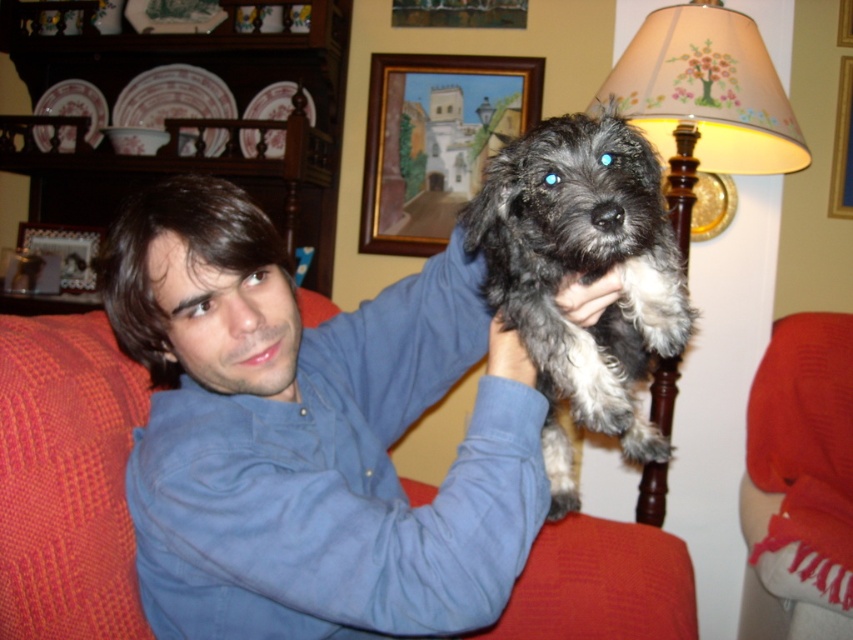
Question: Which of the following is the farthest from the observer?

Choices:
 (A) (419, 240)
 (B) (39, 236)
 (C) (572, 323)

Answer: (B)

Question: Can you confirm if velvet red couch at center is positioned to the left of wooden framed painting at upper center?

Choices:
 (A) yes
 (B) no

Answer: (A)

Question: Which of the following is the farthest from the observer?

Choices:
 (A) wooden picture frame at upper left
 (B) shaggy gray fur at center

Answer: (A)

Question: Which point is closer to the camera taking this photo?

Choices:
 (A) (666, 24)
 (B) (572, 502)

Answer: (B)

Question: From the image, what is the correct spatial relationship of velvet red couch at center in relation to wooden picture frame at upper left?

Choices:
 (A) above
 (B) below

Answer: (B)

Question: Is red fabric chair at lower right further to camera compared to wooden framed painting at upper center?

Choices:
 (A) yes
 (B) no

Answer: (B)